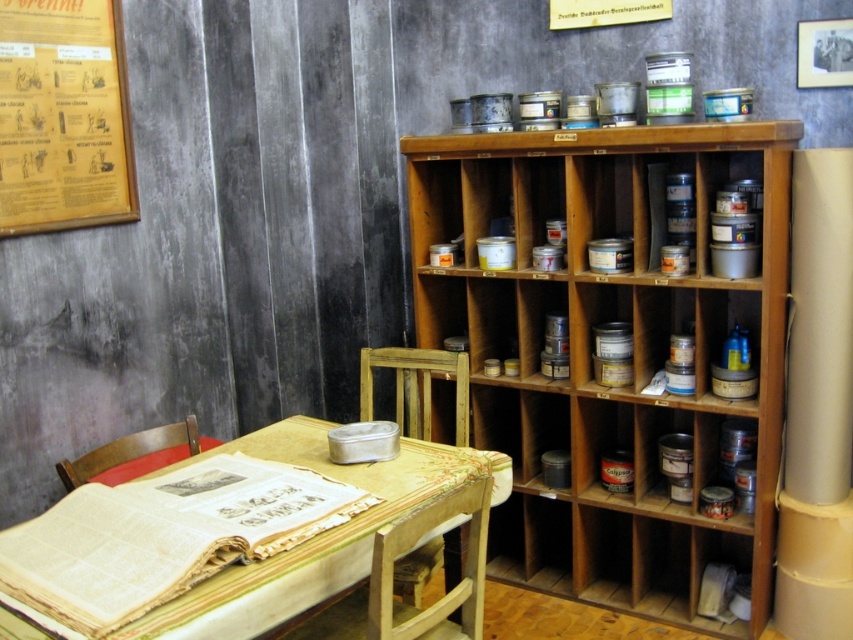
Question: Does wooden shelves at center appear under wooden table at center?

Choices:
 (A) no
 (B) yes

Answer: (A)

Question: Which object appears farthest from the camera in this image?

Choices:
 (A) wooden framed poster at upper left
 (B) wooden table at center
 (C) wooden shelves at center

Answer: (A)

Question: Which point is closer to the camera?

Choices:
 (A) (564, 380)
 (B) (115, 24)

Answer: (B)

Question: In this image, where is wooden framed poster at upper left located relative to wooden table at center?

Choices:
 (A) below
 (B) above

Answer: (B)

Question: Among these objects, which one is nearest to the camera?

Choices:
 (A) wooden table at center
 (B) wooden shelves at center
 (C) wooden framed poster at upper left

Answer: (A)

Question: Does wooden shelves at center lie behind wooden table at center?

Choices:
 (A) yes
 (B) no

Answer: (A)